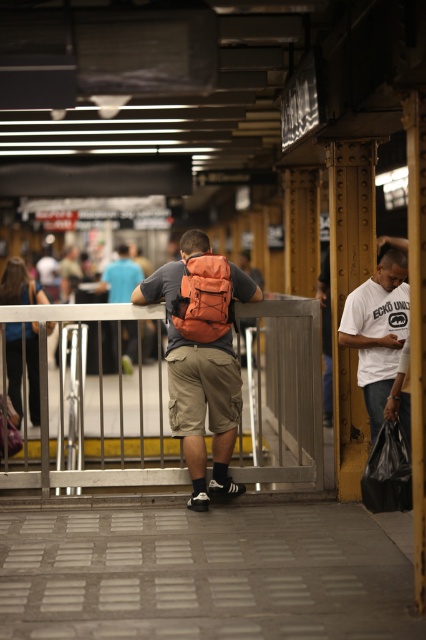
You are a delivery robot with a 2.5 meter long package. You need to move from the white cotton shirt at right to the matte orange backpack at center. Can you fit the package between them without tilting it?

The distance between the white cotton shirt at right and the matte orange backpack at center is 4.30 meters. Since the package is 2.5 meters long, there is enough space to fit it between them without tilting.

You are a photographer positioned at the subway station. You want to capture a photo that includes both the white cotton shirt at right and the matte orange backpack at center. Based on their positions, which object should you focus on first to ensure both are in frame?

The white cotton shirt at right is below the matte orange backpack at center, so you should focus on the matte orange backpack at center first to ensure both are in frame.

You are a security guard in the subway station and need to check the backpacks of two individuals. You have a checklist that requires you to identify which backpack is narrower. Looking at the orange fabric backpack at center and the matte orange backpack at center, which one should you note as narrower?

The orange fabric backpack at center has a lesser width compared to the matte orange backpack at center, so you should note the orange fabric backpack at center as narrower.